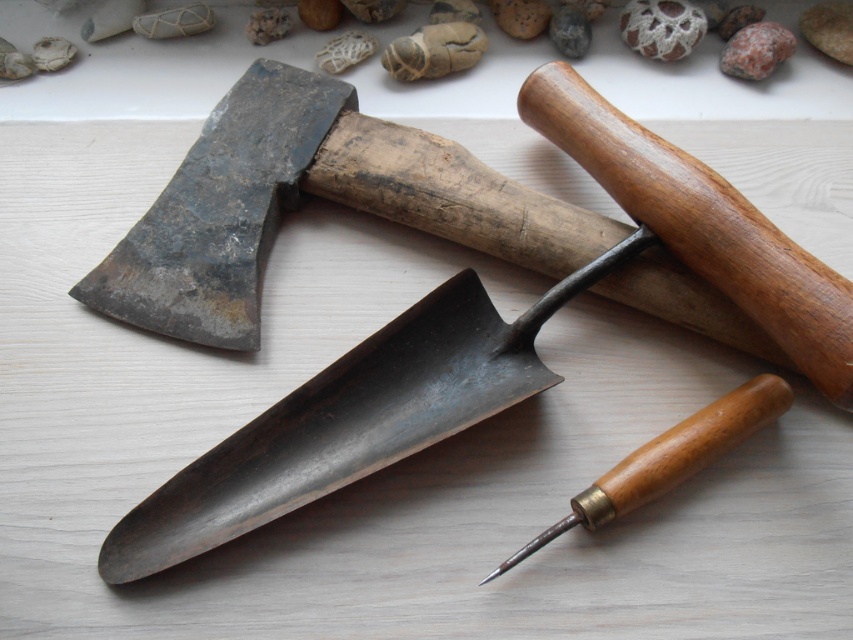
Based on the scene description, can you determine the spatial relationship between the wooden handle chisel at lower right and the smooth brown rock at upper center?

The wooden handle chisel at lower right is positioned below the smooth brown rock at upper center.